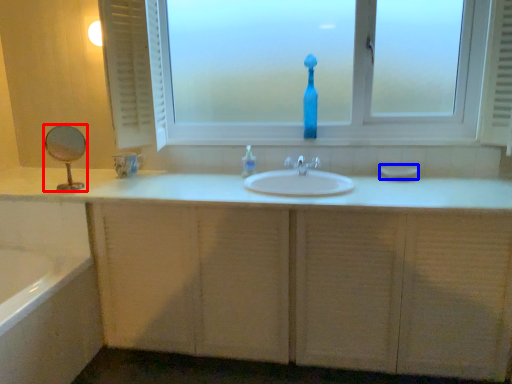
Question: Which of the following is the closest to the observer, mirror (highlighted by a red box) or soap (highlighted by a blue box)?

Choices:
 (A) mirror
 (B) soap

Answer: (A)